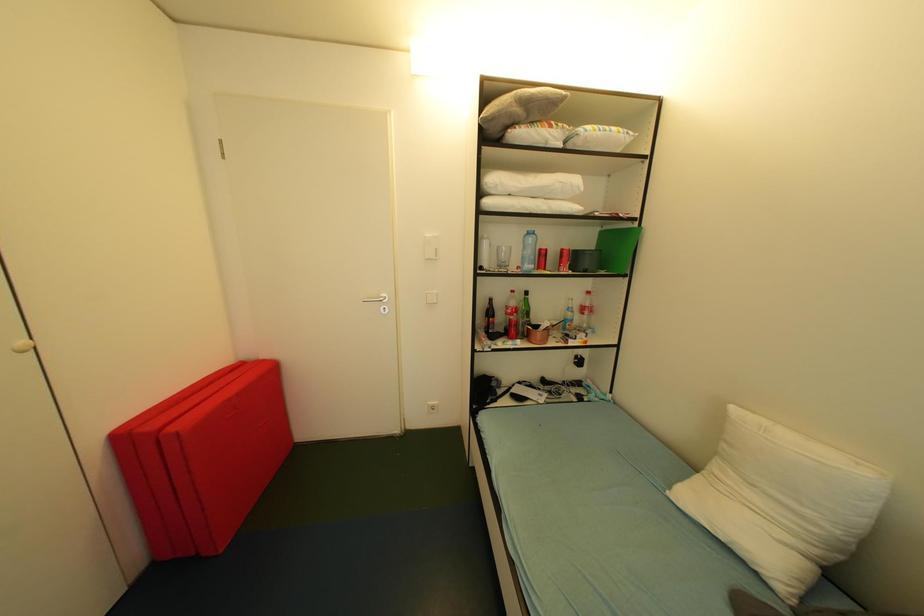
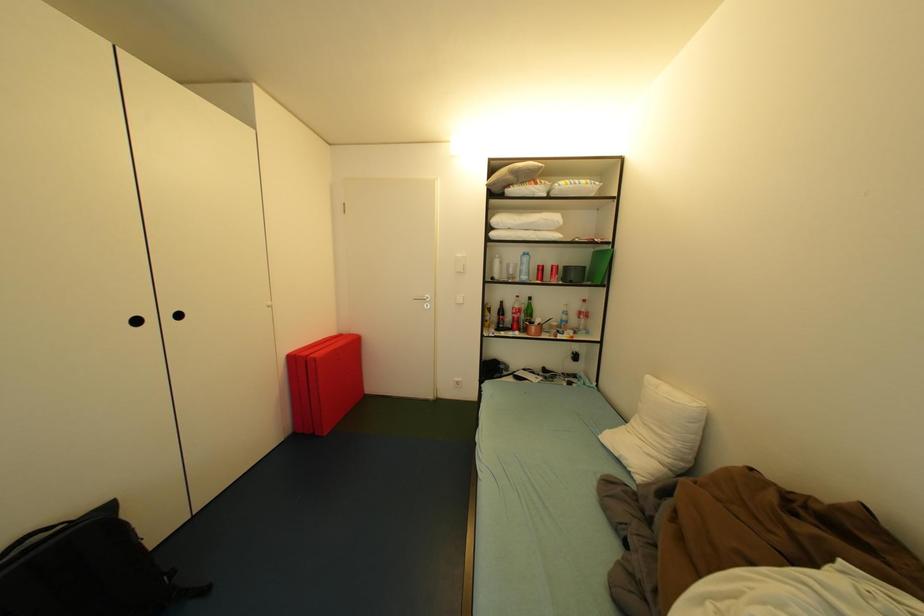
Question: The camera is either moving clockwise (left) or counter-clockwise (right) around the object. The first image is from the beginning of the video and the second image is from the end. Is the camera moving left or right when shooting the video?

Choices:
 (A) Left
 (B) Right

Answer: (B)